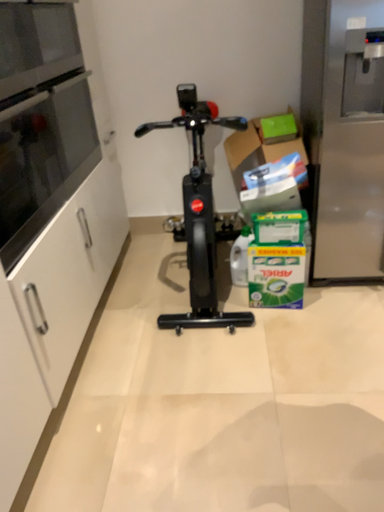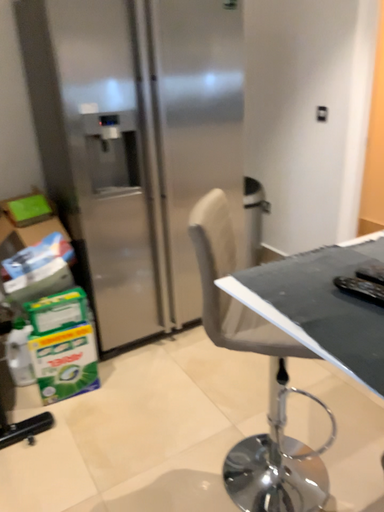
Question: Which way did the camera rotate in the video?

Choices:
 (A) rotated right
 (B) rotated left

Answer: (A)